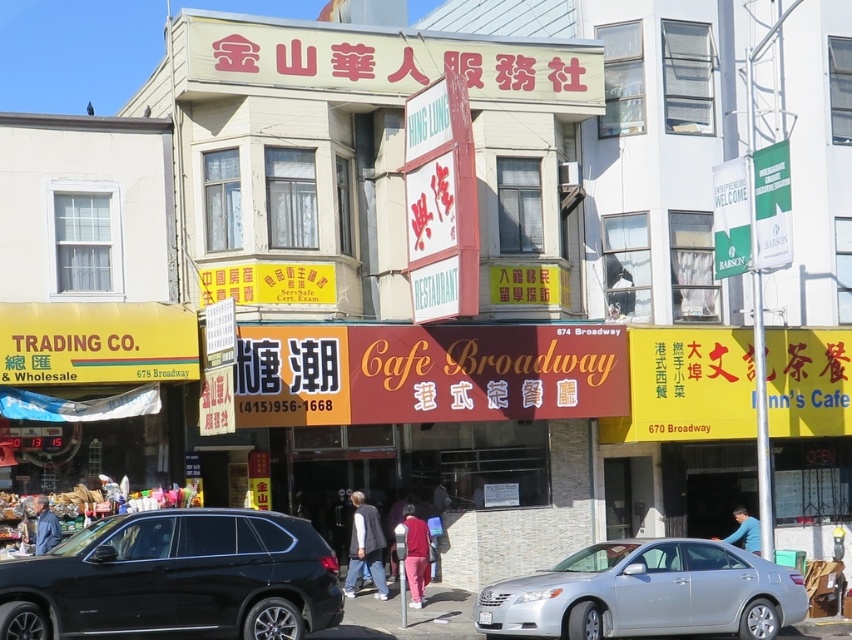
You are a delivery person needing to park your motorcycle between the silver metallic sedan at center and the blue fabric shirt at lower right. Can your motorcycle fit in the space between them?

The silver metallic sedan at center is larger in size than the blue fabric shirt at lower right, but the description does not provide specific measurements of the space between them. Without knowing the exact distance, it is impossible to determine if the motorcycle can fit.

You are a customer in this Chinatown area and you want to buy a jacket that is smaller in size. Which one between the dark gray sweater at center and the dark blue jacket at lower left should you choose?

The dark blue jacket at lower left is smaller in size than the dark gray sweater at center, so you should choose the dark blue jacket at lower left.